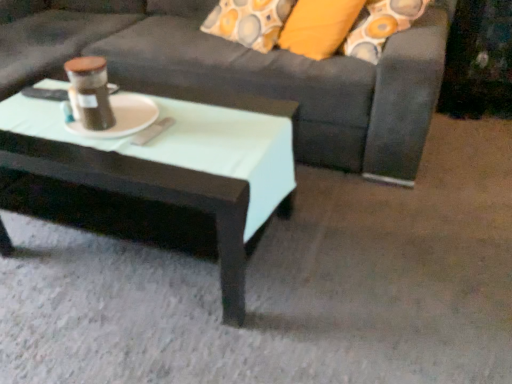
Question: From the image's perspective, would you say matte black coffee table at center is positioned over matte brown jar at center?

Choices:
 (A) no
 (B) yes

Answer: (A)

Question: Can you confirm if matte black coffee table at center is thinner than matte brown jar at center?

Choices:
 (A) no
 (B) yes

Answer: (A)

Question: Is the position of matte black coffee table at center less distant than that of matte brown jar at center?

Choices:
 (A) yes
 (B) no

Answer: (A)

Question: Does matte black coffee table at center turn towards matte brown jar at center?

Choices:
 (A) yes
 (B) no

Answer: (B)

Question: Is matte black coffee table at center shorter than matte brown jar at center?

Choices:
 (A) no
 (B) yes

Answer: (A)

Question: From the image's perspective, is white matte platter at center located above or below dark gray fabric couch at center?

Choices:
 (A) below
 (B) above

Answer: (A)

Question: Considering their positions, is white matte platter at center located in front of or behind dark gray fabric couch at center?

Choices:
 (A) behind
 (B) front

Answer: (A)

Question: Is white matte platter at center taller or shorter than dark gray fabric couch at center?

Choices:
 (A) tall
 (B) short

Answer: (B)

Question: Is point (134, 109) closer or farther from the camera than point (378, 157)?

Choices:
 (A) closer
 (B) farther

Answer: (A)

Question: Is point (68, 77) closer or farther from the camera than point (152, 163)?

Choices:
 (A) closer
 (B) farther

Answer: (B)

Question: From the image's perspective, is matte brown jar at center above or below matte black coffee table at center?

Choices:
 (A) above
 (B) below

Answer: (A)

Question: Is matte brown jar at center wider or thinner than matte black coffee table at center?

Choices:
 (A) wide
 (B) thin

Answer: (B)

Question: From a real-world perspective, is matte brown jar at center physically located above or below matte black coffee table at center?

Choices:
 (A) below
 (B) above

Answer: (B)

Question: From the image's perspective, is matte brown jar at center positioned above or below white matte platter at center?

Choices:
 (A) below
 (B) above

Answer: (B)

Question: Considering the positions of point (83, 89) and point (130, 97), is point (83, 89) closer or farther from the camera than point (130, 97)?

Choices:
 (A) farther
 (B) closer

Answer: (B)